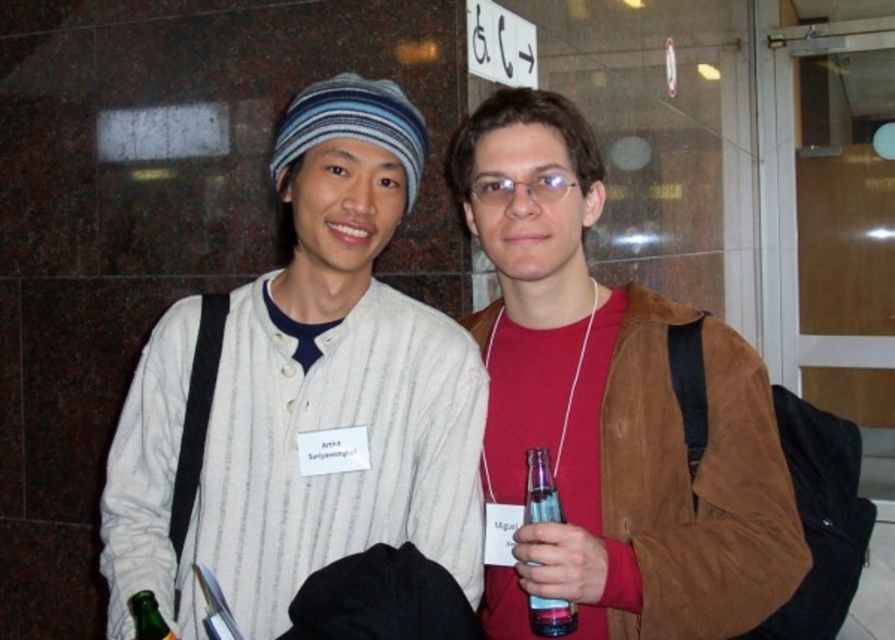
You are organizing a coat rack for the event. The brown suede jacket at center and the green glass bottle at lower left need to be placed on the rack. If the rack has a width limit of 1 meter, can both items fit side by side?

The brown suede jacket at center might be wider than the green glass bottle at lower left, but since the total width isn

You are at an event and want to approach the person wearing the brown suede jacket at center. Which direction should you move relative to the white striped shirt at center?

You should move to the right of the white striped shirt at center to reach the brown suede jacket at center because the white striped shirt at center is blocking the view to the brown suede jacket at center, indicating it is positioned in front.

You are at a networking event and need to hand a business card to the person wearing the brown suede jacket at center. You are currently holding the green glass bottle at lower left. Which direction should you move to reach the person?

The brown suede jacket at center is positioned on the right side of the green glass bottle at lower left, so you should move to your right to reach the person wearing the brown suede jacket at center.